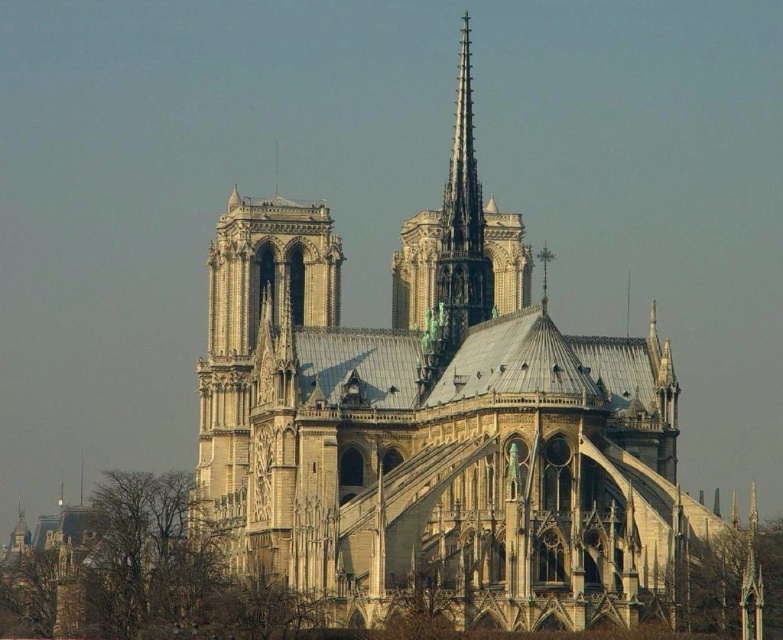
Question: Can you confirm if stone church at center is smaller than dark gray stone spire at center?

Choices:
 (A) yes
 (B) no

Answer: (B)

Question: Where is stone church at center located in relation to dark gray stone spire at center in the image?

Choices:
 (A) below
 (B) above

Answer: (A)

Question: Does stone church at center appear over dark gray stone spire at center?

Choices:
 (A) no
 (B) yes

Answer: (A)

Question: Which point appears closest to the camera in this image?

Choices:
 (A) (453, 317)
 (B) (356, 492)

Answer: (B)